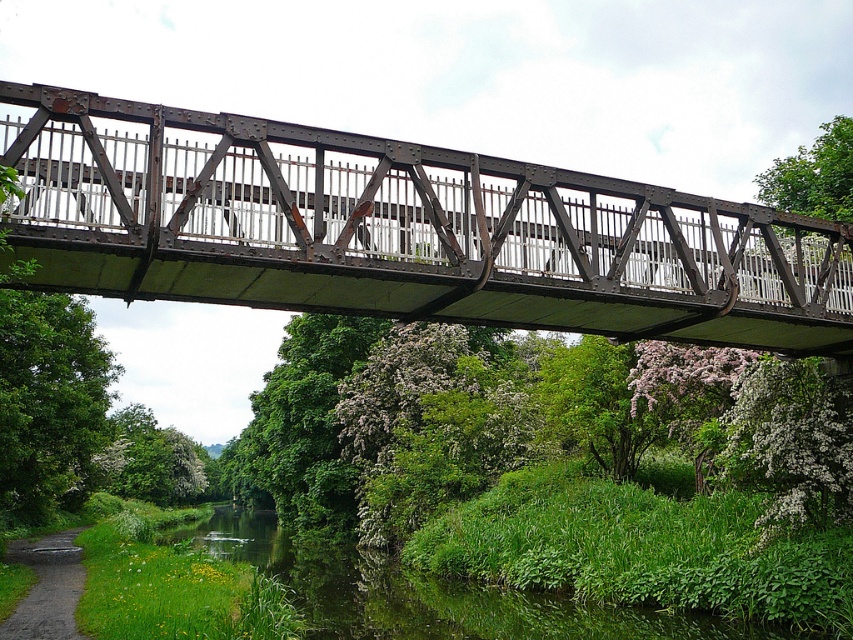
Does rusty metal bridge at center appear on the right side of green leafy river at lower center?

Yes, rusty metal bridge at center is to the right of green leafy river at lower center.

Does rusty metal bridge at center have a lesser height compared to green leafy river at lower center?

Yes, rusty metal bridge at center is shorter than green leafy river at lower center.

Between point (608, 208) and point (450, 580), which one is positioned in front?

Positioned in front is point (608, 208).

The image size is (853, 640). Find the location of `rusty metal bridge at center`. rusty metal bridge at center is located at coordinates (399, 230).

Can you confirm if rusty metal bridge at center is bigger than gravel path at lower left?

No, rusty metal bridge at center is not bigger than gravel path at lower left.

Is rusty metal bridge at center positioned at the back of gravel path at lower left?

That is False.

At what (x,y) coordinates should I click in order to perform the action: click on rusty metal bridge at center. Please return your answer as a coordinate pair (x, y). Looking at the image, I should click on (399, 230).

Is green leafy river at lower center positioned before gravel path at lower left?

No, green leafy river at lower center is further to the viewer.

Can you confirm if green leafy river at lower center is taller than gravel path at lower left?

Yes.

Who is more forward, (717, 618) or (73, 547)?

Point (717, 618) is in front.

What are the coordinates of `green leafy river at lower center` in the screenshot? It's located at (426, 593).